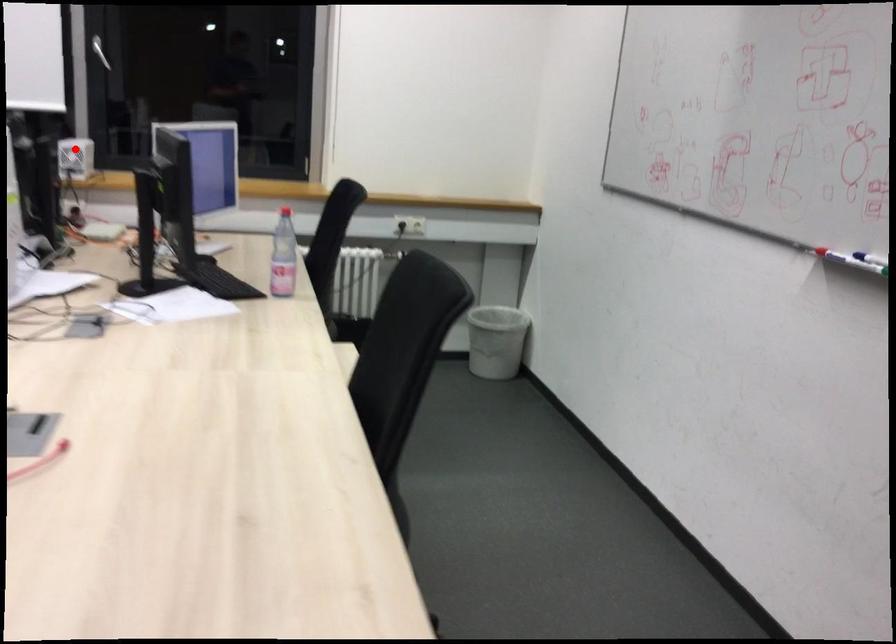
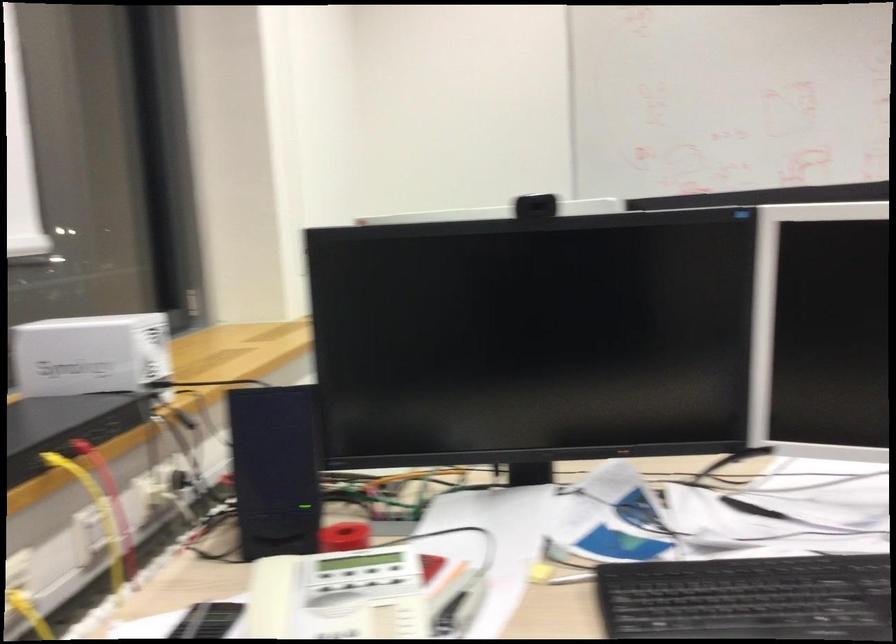
Question: I am providing you with two images of the same scene from different viewpoints. Given a red point in image1, look at the same physical point in image2. Is it:

Choices:
 (A) Closer to the viewpoint
 (B) Farther from the viewpoint

Answer: (A)